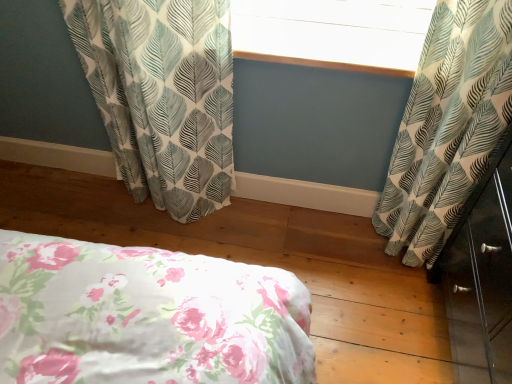
Question: From the image's perspective, does white leaf-patterned curtain at left, marked as the first curtain in a left-to-right arrangement, appear higher than white textured window screen at upper center?

Choices:
 (A) no
 (B) yes

Answer: (A)

Question: Is white leaf-patterned curtain at left, marked as the first curtain in a left-to-right arrangement, at the left side of white textured window screen at upper center?

Choices:
 (A) no
 (B) yes

Answer: (B)

Question: From a real-world perspective, does white leaf-patterned curtain at left, marked as the first curtain in a left-to-right arrangement, sit lower than white textured window screen at upper center?

Choices:
 (A) yes
 (B) no

Answer: (A)

Question: Is white leaf-patterned curtain at left, which is the second curtain in right-to-left order, positioned in front of white textured window screen at upper center?

Choices:
 (A) no
 (B) yes

Answer: (B)

Question: From a real-world perspective, is white leaf-patterned curtain at left, which is the second curtain in right-to-left order, positioned over white textured window screen at upper center based on gravity?

Choices:
 (A) yes
 (B) no

Answer: (B)

Question: Does white leaf-patterned curtain at left, which is the second curtain in right-to-left order, have a greater width compared to white textured window screen at upper center?

Choices:
 (A) yes
 (B) no

Answer: (B)

Question: From a real-world perspective, is white leaf-patterned curtain at right, the 2th curtain from the left, positioned over white leaf-patterned curtain at left, which is the second curtain in right-to-left order, based on gravity?

Choices:
 (A) no
 (B) yes

Answer: (B)

Question: Is white leaf-patterned curtain at right, the 2th curtain from the left, not within white leaf-patterned curtain at left, which is the second curtain in right-to-left order?

Choices:
 (A) no
 (B) yes

Answer: (B)

Question: Is the position of white leaf-patterned curtain at right, the 2th curtain from the left, more distant than that of white leaf-patterned curtain at left, which is the second curtain in right-to-left order?

Choices:
 (A) no
 (B) yes

Answer: (A)

Question: Is white leaf-patterned curtain at right, which ranks as the first curtain in right-to-left order, smaller than white leaf-patterned curtain at left, which is the second curtain in right-to-left order?

Choices:
 (A) no
 (B) yes

Answer: (B)

Question: Can you confirm if white leaf-patterned curtain at right, the 2th curtain from the left, is taller than white leaf-patterned curtain at left, marked as the first curtain in a left-to-right arrangement?

Choices:
 (A) no
 (B) yes

Answer: (B)

Question: Does white leaf-patterned curtain at right, which ranks as the first curtain in right-to-left order, have a greater width compared to white leaf-patterned curtain at left, marked as the first curtain in a left-to-right arrangement?

Choices:
 (A) no
 (B) yes

Answer: (B)

Question: From the image's perspective, is white leaf-patterned curtain at left, marked as the first curtain in a left-to-right arrangement, located above white leaf-patterned curtain at right, which ranks as the first curtain in right-to-left order?

Choices:
 (A) yes
 (B) no

Answer: (A)